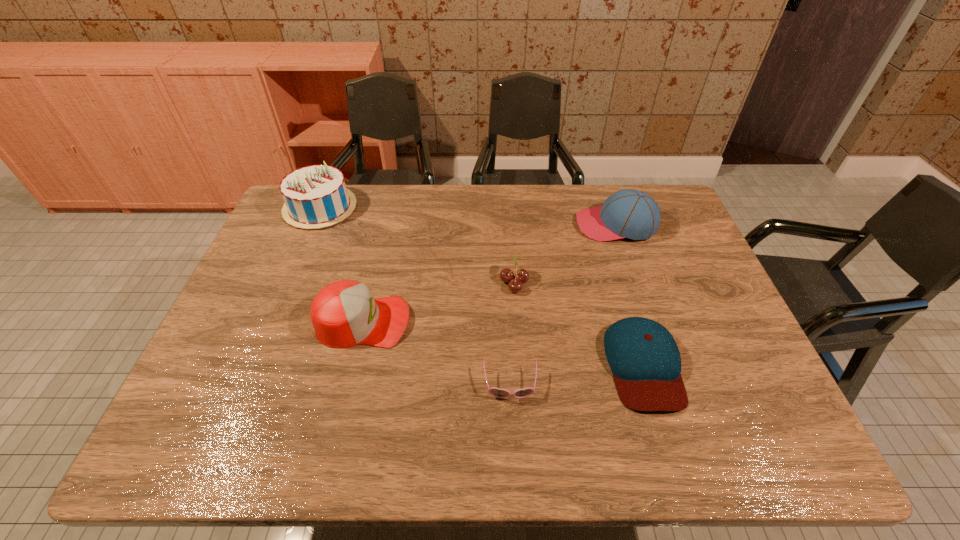
Locate an element on the screen. The height and width of the screenshot is (540, 960). birthday cake is located at coordinates (315, 196).

You are a GUI agent. You are given a task and a screenshot of the screen. Output one action in this format:
    pyautogui.click(x=<x>, y=<y>)
    Task: Click on the farthest baseball cap
    This screenshot has width=960, height=540.
    Given the screenshot: What is the action you would take?
    pyautogui.click(x=629, y=213)

At what (x,y) coordinates should I click in order to perform the action: click on the leftmost baseball cap. Please return your answer as a coordinate pair (x, y). The width and height of the screenshot is (960, 540). Looking at the image, I should click on (344, 313).

At what (x,y) coordinates should I click in order to perform the action: click on the third farthest object. Please return your answer as a coordinate pair (x, y). This screenshot has width=960, height=540. Looking at the image, I should click on (506, 275).

This screenshot has width=960, height=540. I want to click on the shortest baseball cap, so click(644, 358).

Where is `the shortest object`? This screenshot has height=540, width=960. the shortest object is located at coordinates (496, 392).

The height and width of the screenshot is (540, 960). Identify the location of free space located on the front of the birthday cake. (274, 322).

Locate an element on the screen. The height and width of the screenshot is (540, 960). free region located on the front-facing side of the farthest baseball cap is located at coordinates (503, 225).

Where is `free region located 0.220m on the front-facing side of the farthest baseball cap`? free region located 0.220m on the front-facing side of the farthest baseball cap is located at coordinates (509, 225).

What are the coordinates of `free region located 0.300m on the front-facing side of the farthest baseball cap` in the screenshot? It's located at (484, 225).